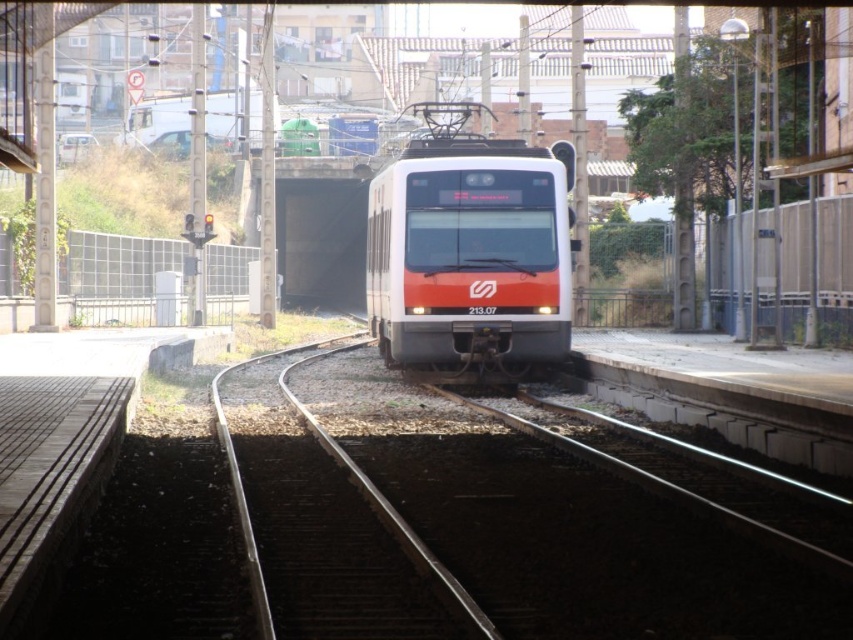
Question: Does white glossy passenger train at center appear under metal at center?

Choices:
 (A) no
 (B) yes

Answer: (A)

Question: Which of the following is the farthest from the observer?

Choices:
 (A) (467, 605)
 (B) (456, 177)

Answer: (B)

Question: Can you confirm if metallic rail at center is positioned below metal at center?

Choices:
 (A) yes
 (B) no

Answer: (A)

Question: Estimate the real-world distances between objects in this image. Which object is closer to the metallic rail at center?

Choices:
 (A) white glossy passenger train at center
 (B) metal at center

Answer: (B)

Question: Which point is closer to the camera taking this photo?

Choices:
 (A) (242, 536)
 (B) (793, 513)
 (C) (546, 339)

Answer: (A)

Question: Observing the image, what is the correct spatial positioning of metallic rail at center in reference to metal at center?

Choices:
 (A) above
 (B) below

Answer: (B)